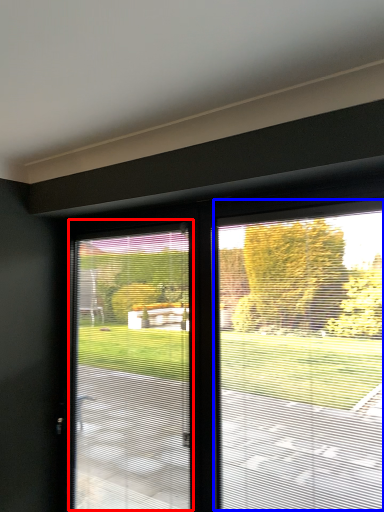
Question: Which point is closer to the camera, window screen (highlighted by a red box) or window screen (highlighted by a blue box)?

Choices:
 (A) window screen
 (B) window screen

Answer: (B)